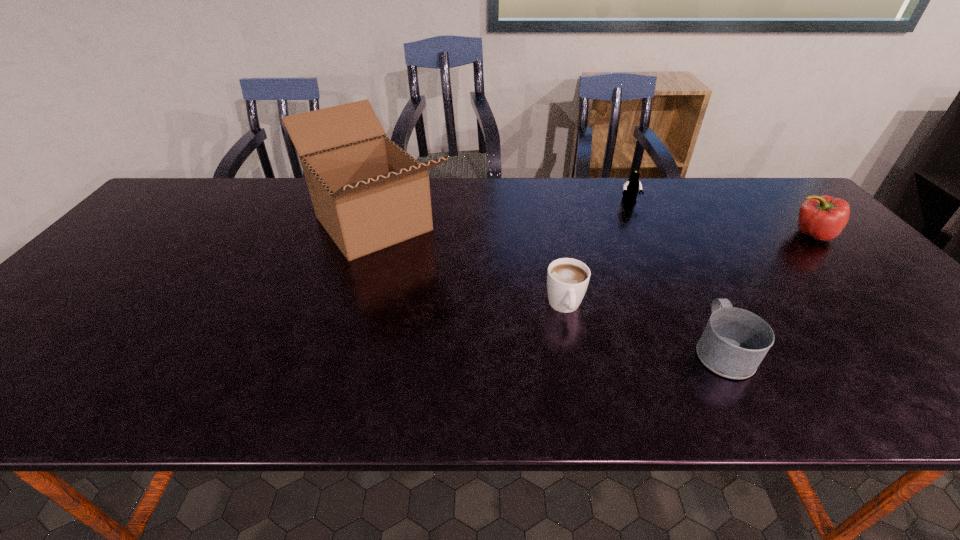
Find the location of a particular element. This screenshot has width=960, height=540. the second closest object relative to the mug is located at coordinates (823, 217).

Locate an element on the screen. vacant position in the image that satisfies the following two spatial constraints: 1. on the front-facing side of the rightmost object; 2. on the right side of the Lego is located at coordinates (644, 234).